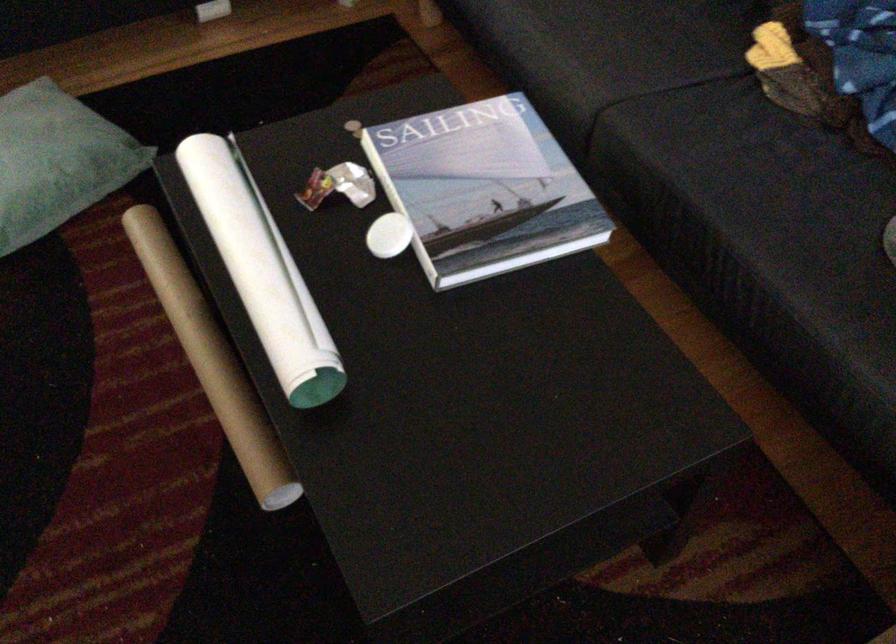
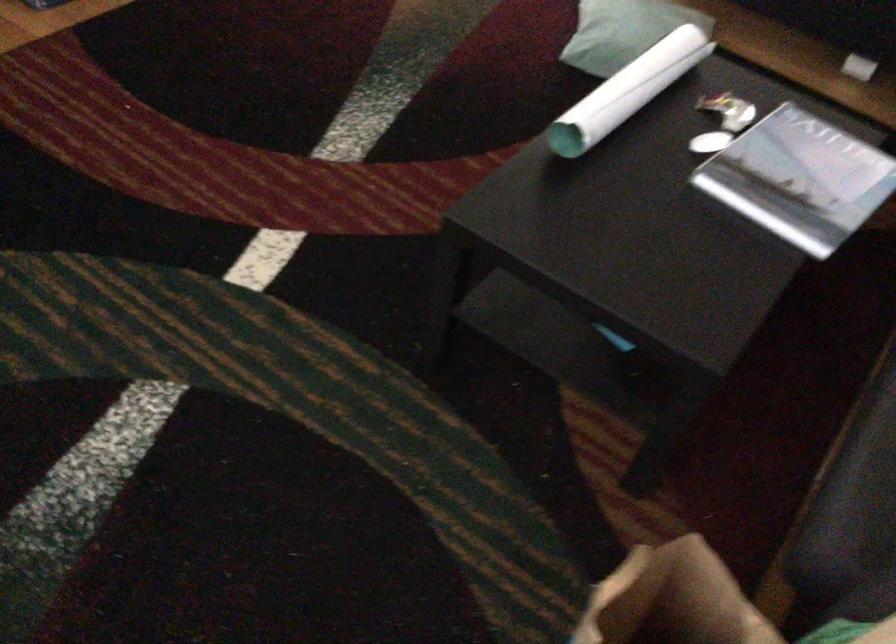
In the second image, find the point that corresponds to (394,232) in the first image.

(709, 142)